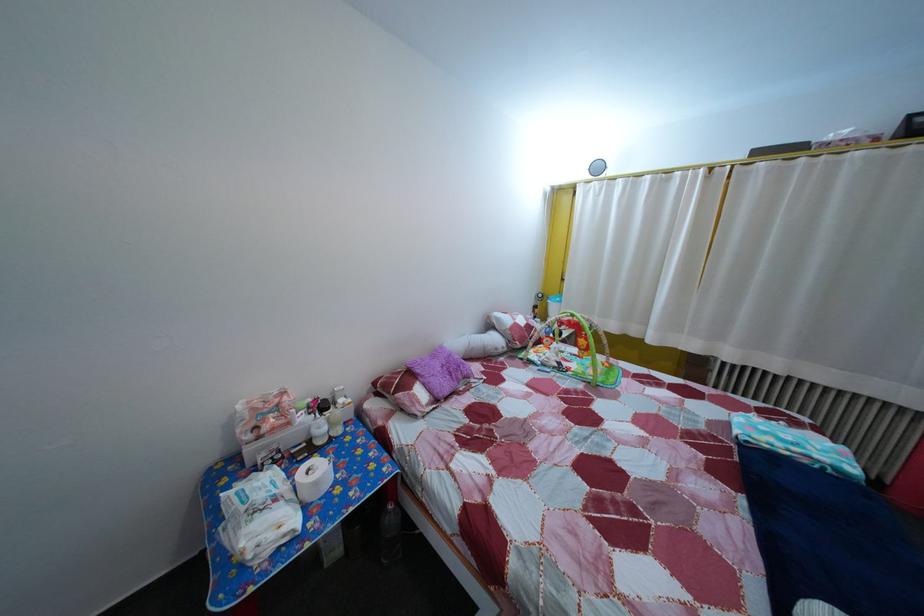
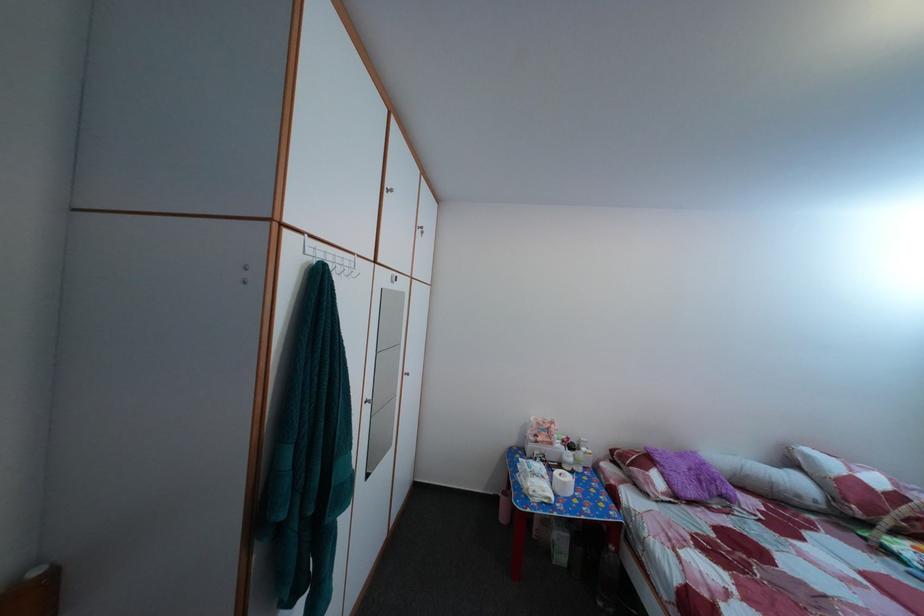
Find the pixel in the second image that matches the point at 282,544 in the first image.

(551, 500)